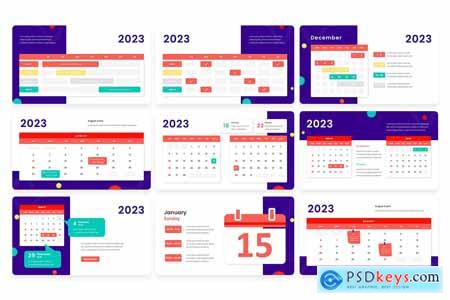
The width and height of the screenshot is (450, 300). I want to click on normal calendars, so click(91, 159), click(199, 163), click(46, 225), click(361, 252), click(335, 157), click(409, 158).